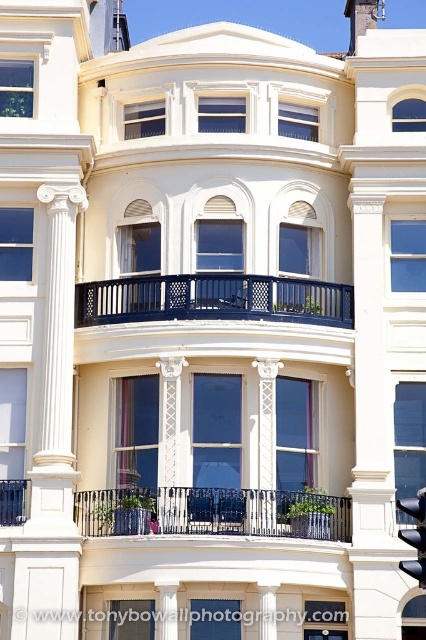
Question: Can you confirm if matte black balcony at center is positioned above black glass traffic light at center?

Choices:
 (A) no
 (B) yes

Answer: (B)

Question: Which of the following is the farthest from the observer?

Choices:
 (A) black wrought iron balcony at center
 (B) matte black balcony at center
 (C) black glass traffic light at center

Answer: (B)

Question: Which of the following is the closest to the observer?

Choices:
 (A) (261, 301)
 (B) (425, 584)

Answer: (B)

Question: Observing the image, what is the correct spatial positioning of black wrought iron balcony at center in reference to black glass traffic light at center?

Choices:
 (A) below
 (B) above

Answer: (B)

Question: Is black wrought iron balcony at center positioned at the back of black glass traffic light at center?

Choices:
 (A) no
 (B) yes

Answer: (B)

Question: Which point is closer to the camera taking this photo?

Choices:
 (A) (146, 305)
 (B) (250, 528)
 (C) (411, 572)

Answer: (C)